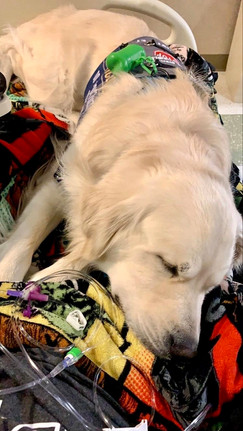
Find the location of a particular element. This screenshot has height=431, width=243. floor is located at coordinates (236, 126).